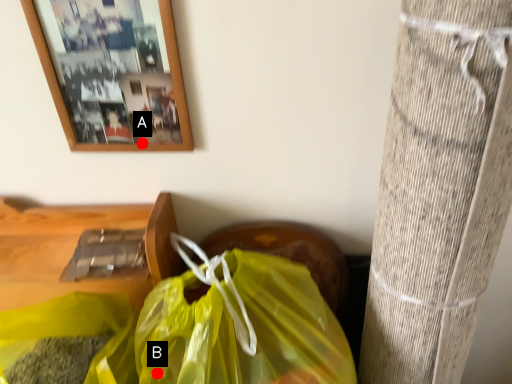
Question: Two points are circled on the image, labeled by A and B beside each circle. Which point appears farthest from the camera in this image?

Choices:
 (A) A is further
 (B) B is further

Answer: (A)